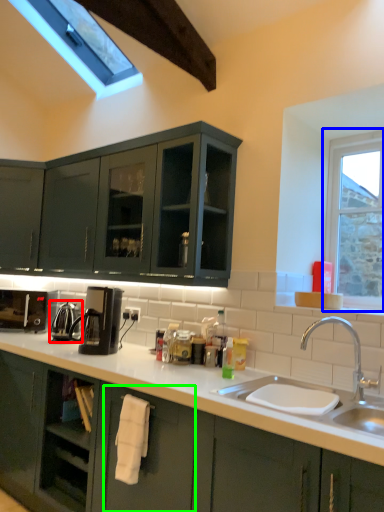
Question: Which is farther away from appliance (highlighted by a red box)? window (highlighted by a blue box) or drawer (highlighted by a green box)?

Choices:
 (A) window
 (B) drawer

Answer: (A)